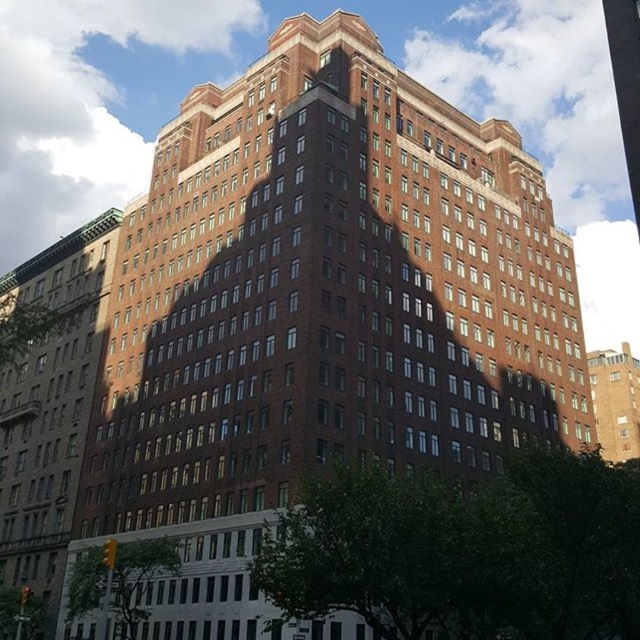
You are standing at the origin point of a coordinate system where the image is mapped. You want to locate the brown brick building at center. What are its coordinates?

The coordinates of the brown brick building at center are at point (51, 406).

You are standing in a park and see the brown brick building at center. If you want to take a photo of it from a distance of exactly 70 meters, should you move closer or farther away?

The brown brick building at center is currently 67.99 meters away. To reach a distance of 70 meters, you should move farther away from the building.